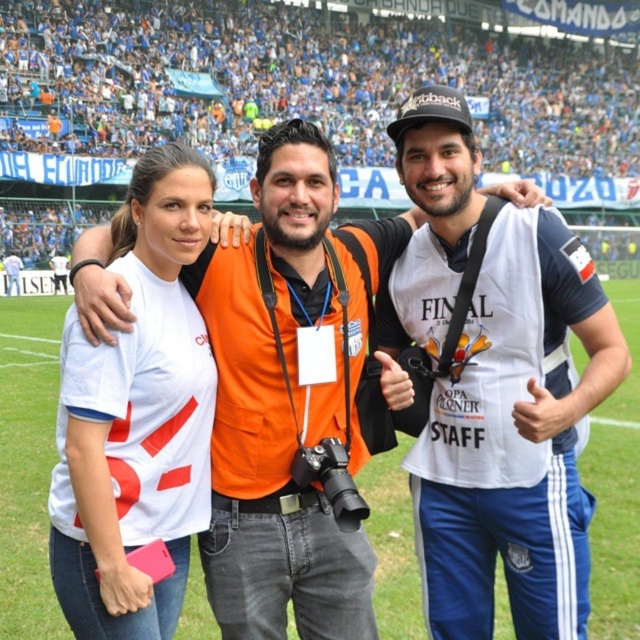
Can you confirm if white jersey at center is bigger than white matte t-shirt at center?

Yes.

Between white jersey at center and white matte t-shirt at center, which one appears on the right side from the viewer's perspective?

white jersey at center is more to the right.

Is point (545, 564) positioned in front of point (108, 429)?

No, it is behind (108, 429).

This screenshot has height=640, width=640. In order to click on white jersey at center in this screenshot , I will do `click(515, 438)`.

Is point (484, 445) closer to viewer compared to point (305, 522)?

That is True.

Is point (570, 266) behind point (356, 227)?

That is False.

Does point (460, 536) come closer to viewer compared to point (259, 337)?

That is False.

In order to click on white jersey at center in this screenshot , I will do `click(515, 438)`.

Is orange fabric shirt at center shorter than white matte t-shirt at center?

Incorrect, orange fabric shirt at center's height does not fall short of white matte t-shirt at center's.

Does orange fabric shirt at center have a greater height compared to white matte t-shirt at center?

Indeed, orange fabric shirt at center has a greater height compared to white matte t-shirt at center.

Locate an element on the screen. Image resolution: width=640 pixels, height=640 pixels. orange fabric shirt at center is located at coordinates coord(266,483).

Where is `orange fabric shirt at center`? Image resolution: width=640 pixels, height=640 pixels. orange fabric shirt at center is located at coordinates (266, 483).